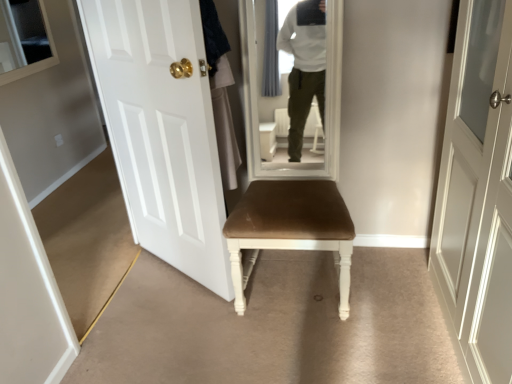
What do you see at coordinates (162, 130) in the screenshot? I see `white glossy door at left` at bounding box center [162, 130].

Where is `white glossy door at left`? white glossy door at left is located at coordinates pyautogui.click(x=162, y=130).

Identify the location of brown velvet chair at center. The image size is (512, 384). (290, 229).

What do you see at coordinates (290, 229) in the screenshot?
I see `brown velvet chair at center` at bounding box center [290, 229].

Locate an element on the screen. The image size is (512, 384). white glossy door at left is located at coordinates (162, 130).

Does white glossy door at left appear on the left side of brown velvet chair at center?

Yes, white glossy door at left is to the left of brown velvet chair at center.

In the image, is white glossy door at left positioned in front of or behind brown velvet chair at center?

Clearly, white glossy door at left is in front of brown velvet chair at center.

Does point (204, 212) come farther from viewer compared to point (243, 247)?

Yes, it is.

From the image's perspective, is white glossy door at left on top of brown velvet chair at center?

Yes, from the image's perspective, white glossy door at left is above brown velvet chair at center.

From a real-world perspective, who is located higher, white glossy door at left or brown velvet chair at center?

In real-world perspective, white glossy door at left is above.

Considering the relative sizes of white glossy door at left and brown velvet chair at center in the image provided, is white glossy door at left wider than brown velvet chair at center?

No, white glossy door at left is not wider than brown velvet chair at center.

Who is shorter, white glossy door at left or brown velvet chair at center?

Standing shorter between the two is brown velvet chair at center.

Considering the sizes of objects white glossy door at left and brown velvet chair at center in the image provided, who is bigger, white glossy door at left or brown velvet chair at center?

brown velvet chair at center.

Is white glossy door at left outside of brown velvet chair at center?

Yes, white glossy door at left is located beyond the bounds of brown velvet chair at center.

Are white glossy door at left and brown velvet chair at center far apart?

They are positioned close to each other.

Is white glossy door at left facing away from brown velvet chair at center?

white glossy door at left does not have its back to brown velvet chair at center.

Locate an element on the screen. Image resolution: width=512 pixels, height=384 pixels. door above the brown velvet chair at center (from a real-world perspective) is located at coordinates (162, 130).

Which is more to the left, brown velvet chair at center or white glossy door at left?

From the viewer's perspective, white glossy door at left appears more on the left side.

Is brown velvet chair at center in front of or behind white glossy door at left in the image?

brown velvet chair at center is positioned farther from the viewer than white glossy door at left.

Is point (234, 286) farther from viewer compared to point (179, 12)?

Yes.

From the image's perspective, would you say brown velvet chair at center is shown under white glossy door at left?

Yes.

From a real-world perspective, is brown velvet chair at center beneath white glossy door at left?

Yes, from a real-world perspective, brown velvet chair at center is below white glossy door at left.

Considering the sizes of objects brown velvet chair at center and white glossy door at left in the image provided, who is thinner, brown velvet chair at center or white glossy door at left?

Thinner between the two is white glossy door at left.

Considering the relative sizes of brown velvet chair at center and white glossy door at left in the image provided, is brown velvet chair at center shorter than white glossy door at left?

Yes, brown velvet chair at center is shorter than white glossy door at left.

Considering the sizes of objects brown velvet chair at center and white glossy door at left in the image provided, who is bigger, brown velvet chair at center or white glossy door at left?

brown velvet chair at center.

Is white glossy door at left located within brown velvet chair at center?

Definitely not — white glossy door at left is not inside brown velvet chair at center.

Is brown velvet chair at center in contact with white glossy door at left?

No, brown velvet chair at center is not touching white glossy door at left.

Is brown velvet chair at center facing towards white glossy door at left?

No.

How different are the orientations of brown velvet chair at center and white glossy door at left in degrees?

brown velvet chair at center and white glossy door at left are facing 36.4 degrees away from each other.

Find the location of `chair below the white glossy door at left (from the image's perspective)`. chair below the white glossy door at left (from the image's perspective) is located at coordinates (290, 229).

Locate an element on the screen. door positioned vertically above the brown velvet chair at center (from a real-world perspective) is located at coordinates (162, 130).

You are a GUI agent. You are given a task and a screenshot of the screen. Output one action in this format:
    pyautogui.click(x=<x>, y=<y>)
    Task: Click on the chair below the white glossy door at left (from the image's perspective)
    The image size is (512, 384).
    Given the screenshot: What is the action you would take?
    pyautogui.click(x=290, y=229)